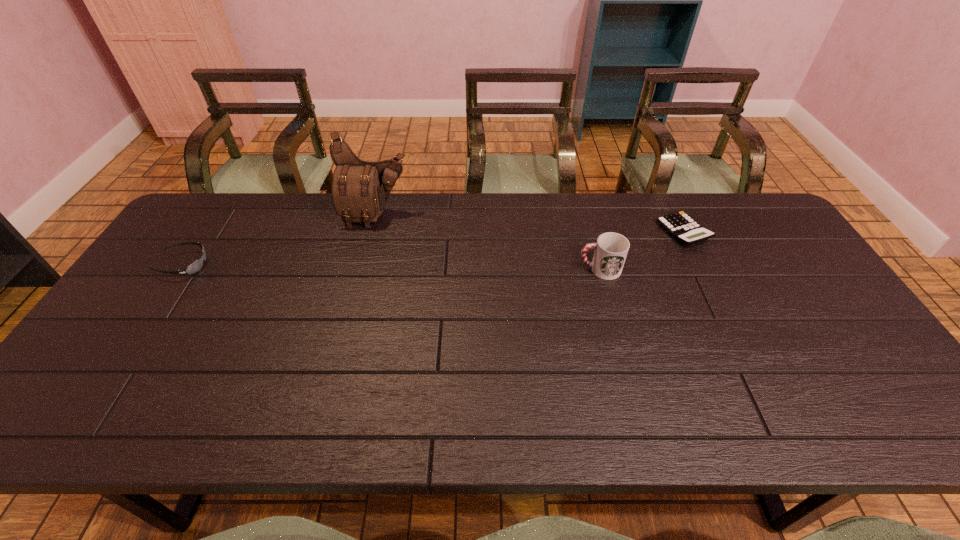
You are a GUI agent. You are given a task and a screenshot of the screen. Output one action in this format:
    pyautogui.click(x=<x>, y=<y>)
    Task: Click on the vacant space located on the handle side of the second object from right to left
    Image resolution: width=960 pixels, height=540 pixels.
    Given the screenshot: What is the action you would take?
    pyautogui.click(x=446, y=269)

This screenshot has width=960, height=540. Identify the location of vacant position located 0.080m on the handle side of the second object from right to left. (550, 269).

Where is `vacant space located on the lenses of the leftmost object`? The image size is (960, 540). vacant space located on the lenses of the leftmost object is located at coordinates (252, 265).

You are a GUI agent. You are given a task and a screenshot of the screen. Output one action in this format:
    pyautogui.click(x=<x>, y=<y>)
    Task: Click on the vacant region located 0.200m on the front of the shortest object
    This screenshot has height=540, width=960.
    Given the screenshot: What is the action you would take?
    pyautogui.click(x=717, y=300)

Image resolution: width=960 pixels, height=540 pixels. I want to click on shoulder bag that is at the far edge, so click(x=360, y=189).

Find the location of a particular element. calculator present at the far edge is located at coordinates (682, 227).

Image resolution: width=960 pixels, height=540 pixels. I want to click on object positioned at the left edge, so click(189, 270).

The image size is (960, 540). In order to click on vacant space at the far edge in this screenshot , I will do `click(544, 198)`.

Where is `vacant point at the near edge`? The width and height of the screenshot is (960, 540). vacant point at the near edge is located at coordinates (269, 415).

In the image, there is a desktop. What are the coordinates of `free space at the left edge` in the screenshot? It's located at (174, 253).